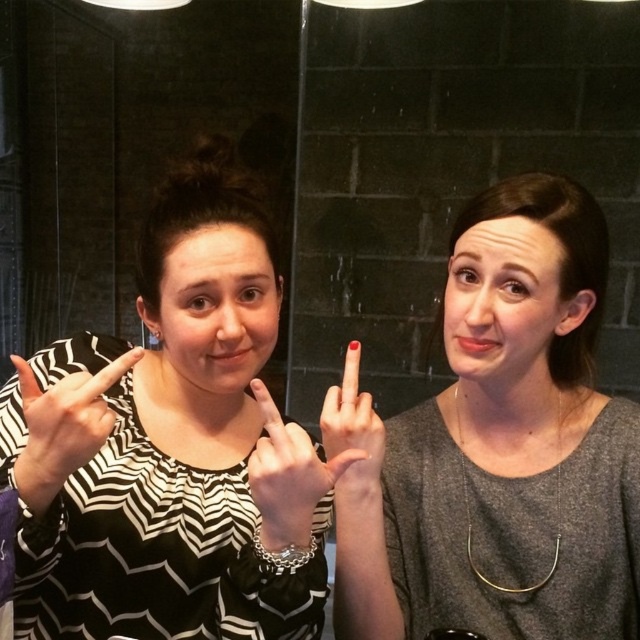
Is black and white striped shirt at left shorter than nail polish at middle finger at center?

No, black and white striped shirt at left is not shorter than nail polish at middle finger at center.

Does point (150, 609) come in front of point (372, 413)?

That is False.

Find the location of a particular element. Image resolution: width=640 pixels, height=640 pixels. black and white striped shirt at left is located at coordinates (172, 445).

The width and height of the screenshot is (640, 640). I want to click on black and white striped shirt at left, so click(x=172, y=445).

Is black and white striped shirt at left behind zebra-patterned shirt sleeve at left?

That is True.

Can you confirm if black and white striped shirt at left is smaller than zebra-patterned shirt sleeve at left?

Actually, black and white striped shirt at left might be larger than zebra-patterned shirt sleeve at left.

Which is in front, point (100, 624) or point (24, 400)?

Point (24, 400) is more forward.

This screenshot has height=640, width=640. I want to click on black and white striped shirt at left, so click(172, 445).

Can you confirm if matte black hand at center is shorter than zebra-patterned shirt sleeve at left?

Incorrect, matte black hand at center's height does not fall short of zebra-patterned shirt sleeve at left's.

Does matte black hand at center have a larger size compared to zebra-patterned shirt sleeve at left?

Yes, matte black hand at center is bigger than zebra-patterned shirt sleeve at left.

The width and height of the screenshot is (640, 640). In order to click on matte black hand at center in this screenshot , I will do `click(289, 476)`.